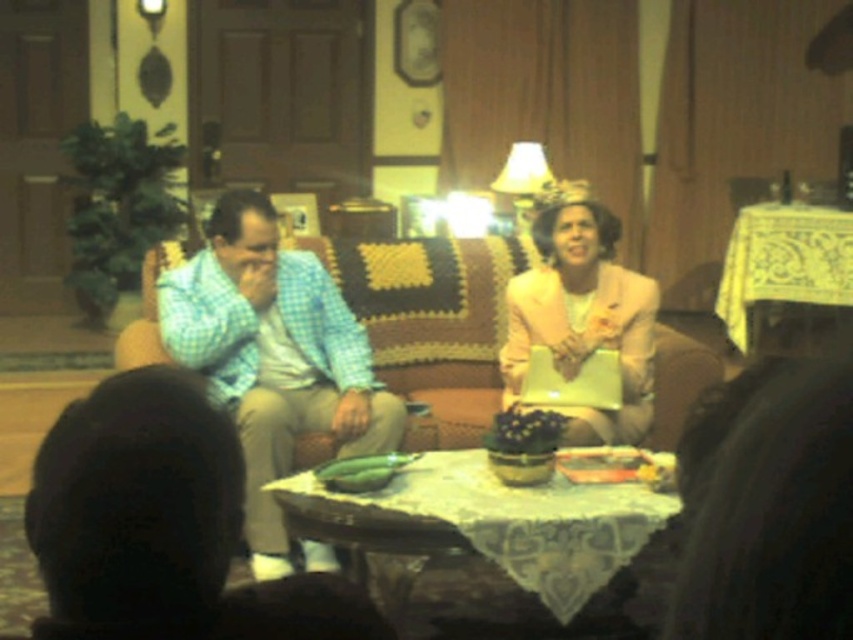
Between knitted fabric couch at center and yellow lace tablecloth at right, which one has less height?

knitted fabric couch at center

Does knitted fabric couch at center come in front of yellow lace tablecloth at right?

Yes, knitted fabric couch at center is in front of yellow lace tablecloth at right.

Which is in front, point (461, 256) or point (796, 211)?

Positioned in front is point (461, 256).

This screenshot has width=853, height=640. In order to click on knitted fabric couch at center in this screenshot , I will do `click(432, 323)`.

What do you see at coordinates (273, 356) in the screenshot? The width and height of the screenshot is (853, 640). I see `checkered fabric shirt at center` at bounding box center [273, 356].

Is checkered fabric shirt at center taller than yellow lace tablecloth at right?

Indeed, checkered fabric shirt at center has a greater height compared to yellow lace tablecloth at right.

Locate an element on the screen. checkered fabric shirt at center is located at coordinates (273, 356).

The height and width of the screenshot is (640, 853). What are the coordinates of `checkered fabric shirt at center` in the screenshot? It's located at (273, 356).

Between green fabric couch at center and matte pink suit at center, which one is positioned lower?

Positioned lower is green fabric couch at center.

Is green fabric couch at center further to the viewer compared to matte pink suit at center?

No, it is not.

Is point (184, 458) closer to viewer compared to point (581, 417)?

Yes.

Locate an element on the screen. This screenshot has width=853, height=640. green fabric couch at center is located at coordinates (161, 525).